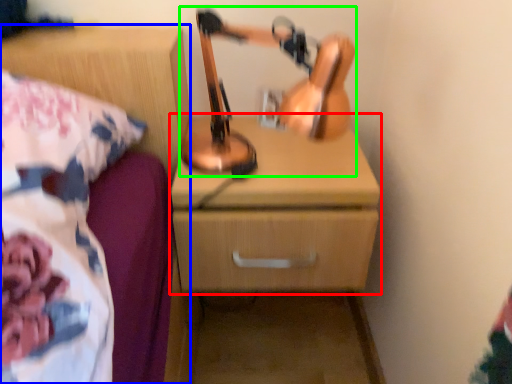
Question: Considering the real-world distances, which object is closest to chest of drawers (highlighted by a red box)? nightstand (highlighted by a blue box) or table lamp (highlighted by a green box).

Choices:
 (A) nightstand
 (B) table lamp

Answer: (B)